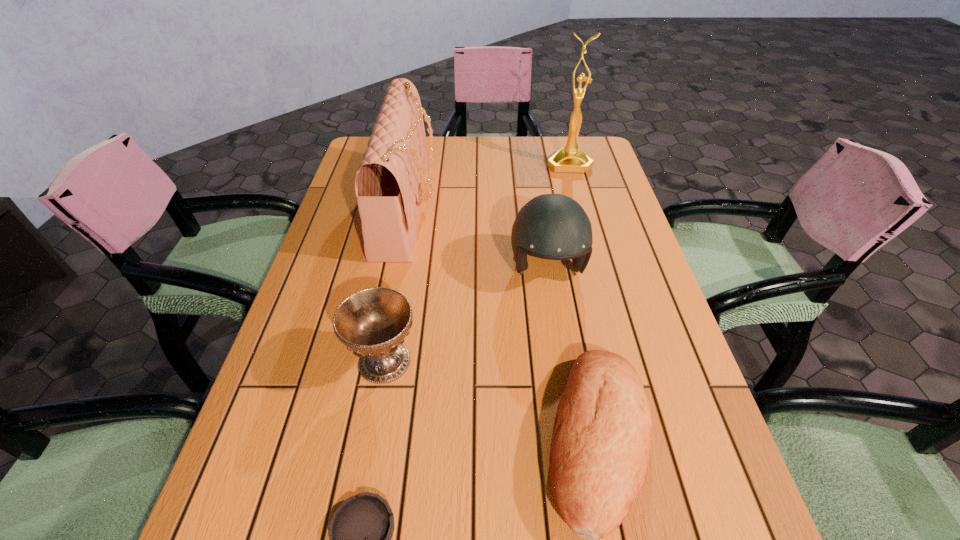
Identify the location of the tallest object. (569, 158).

Find the location of `the fifth shortest object`. the fifth shortest object is located at coordinates (390, 182).

At what (x,y) coordinates should I click in order to perform the action: click on football helmet. Please return your answer as a coordinate pair (x, y). The height and width of the screenshot is (540, 960). Looking at the image, I should click on (553, 226).

Image resolution: width=960 pixels, height=540 pixels. What are the coordinates of `chalice` in the screenshot? It's located at (373, 322).

The width and height of the screenshot is (960, 540). In order to click on vacant region located on the front-facing side of the tallest object in this screenshot , I will do `click(584, 220)`.

The image size is (960, 540). I want to click on free spot located on the front-facing side of the handbag, so click(x=558, y=209).

Where is `vacant position located at the face opening of the fourth shortest object`? This screenshot has height=540, width=960. vacant position located at the face opening of the fourth shortest object is located at coordinates (564, 384).

What are the coordinates of `free region located 0.120m on the front of the third shortest object` in the screenshot? It's located at (367, 455).

The image size is (960, 540). I want to click on award situated at the far edge, so click(x=569, y=158).

Where is `handbag present at the far edge`? handbag present at the far edge is located at coordinates (390, 182).